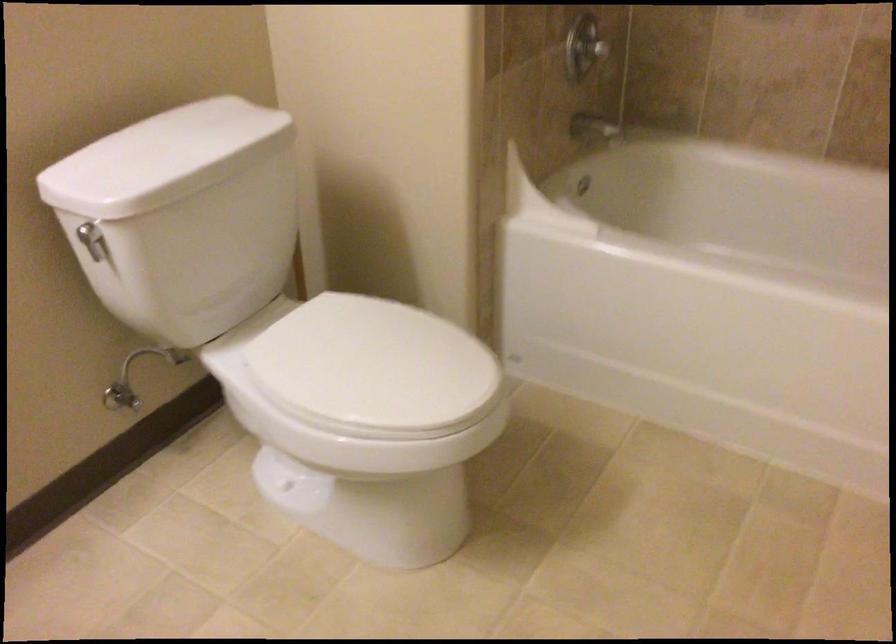
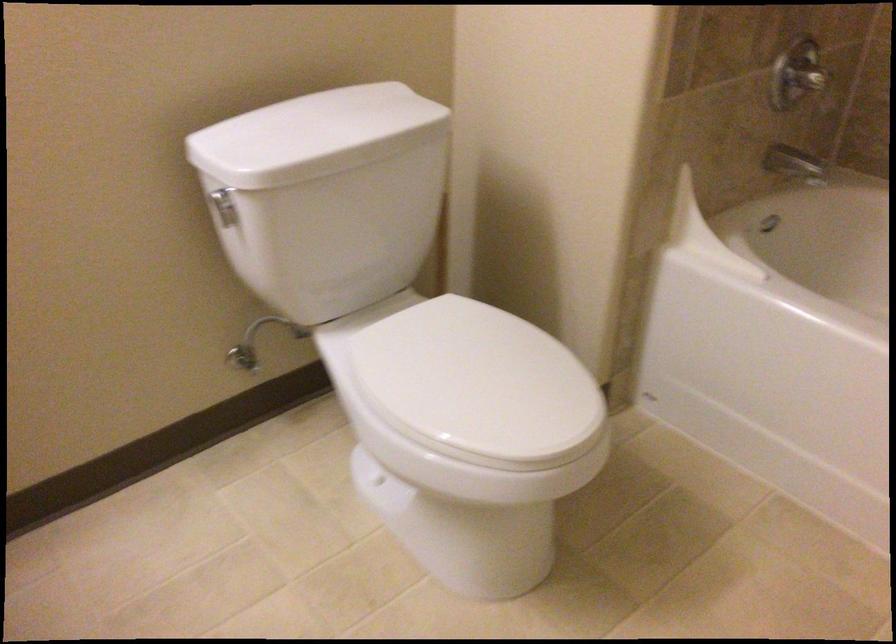
The point at (118, 395) is marked in the first image. Where is the corresponding point in the second image?

(243, 357)